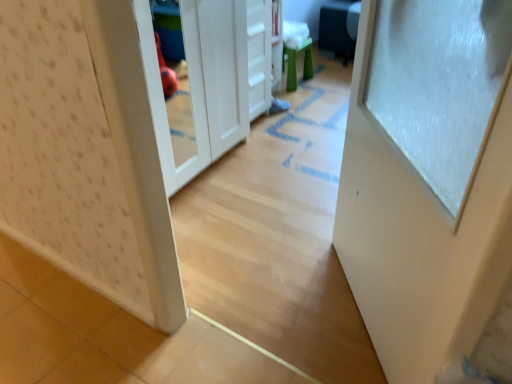
Question: From the image's perspective, is white glossy door at right over white matte drawer at center?

Choices:
 (A) no
 (B) yes

Answer: (A)

Question: Can we say white glossy door at right lies outside white matte drawer at center?

Choices:
 (A) no
 (B) yes

Answer: (B)

Question: Would you consider white glossy door at right to be distant from white matte drawer at center?

Choices:
 (A) yes
 (B) no

Answer: (A)

Question: Is white matte drawer at center at the back of white glossy door at right?

Choices:
 (A) no
 (B) yes

Answer: (A)

Question: From the image's perspective, would you say white glossy door at right is shown under white matte drawer at center?

Choices:
 (A) no
 (B) yes

Answer: (B)

Question: Can you confirm if white glossy door at right is wider than white matte drawer at center?

Choices:
 (A) yes
 (B) no

Answer: (B)

Question: Is green rubber stool at center facing away from white glossy door at right?

Choices:
 (A) yes
 (B) no

Answer: (B)

Question: Is green rubber stool at center not within white glossy door at right?

Choices:
 (A) yes
 (B) no

Answer: (A)

Question: Is white glossy door at right a part of green rubber stool at center?

Choices:
 (A) yes
 (B) no

Answer: (B)

Question: Is green rubber stool at center positioned far away from white glossy door at right?

Choices:
 (A) yes
 (B) no

Answer: (A)

Question: Does green rubber stool at center have a lesser height compared to white glossy door at right?

Choices:
 (A) yes
 (B) no

Answer: (A)

Question: Is green rubber stool at center next to white glossy door at right?

Choices:
 (A) no
 (B) yes

Answer: (A)

Question: From the image's perspective, is white matte drawer at center on top of green rubber stool at center?

Choices:
 (A) no
 (B) yes

Answer: (A)